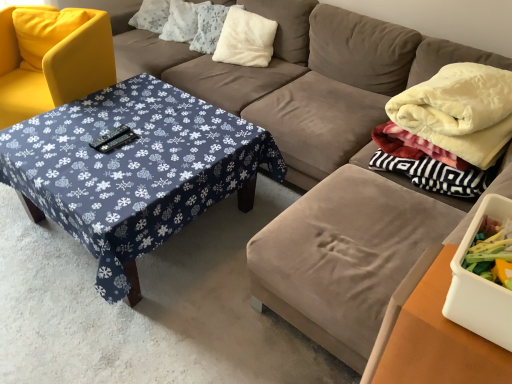
In order to face white fluffy pillow at upper center, which is the 1th pillow from left to right, should I rotate leftwards or rightwards?

To face it directly, rotate left by 9.389 degrees.

What do you see at coordinates (181, 21) in the screenshot? The height and width of the screenshot is (384, 512). I see `white fluffy pillow at upper center, the third pillow when ordered from right to left` at bounding box center [181, 21].

Describe the element at coordinates (459, 111) in the screenshot. The height and width of the screenshot is (384, 512). I see `velvet white blanket at right` at that location.

The image size is (512, 384). I want to click on white fluffy pillow at upper center, which is counted as the first pillow, starting from the right, so click(x=245, y=39).

What is the approximate height of yellow fabric chair at left?

yellow fabric chair at left is 29.38 inches tall.

The image size is (512, 384). In order to click on white fluffy pillow at center, the second pillow in the left-to-right sequence in this screenshot , I will do `click(208, 27)`.

Measure the distance between point (206, 52) and camera.

Point (206, 52) is 2.88 meters from camera.

The width and height of the screenshot is (512, 384). Find the location of `white fluffy pillow at upper center, the third pillow when ordered from right to left`. white fluffy pillow at upper center, the third pillow when ordered from right to left is located at coordinates (181, 21).

Is blue fabric-covered table at center-left oriented away from wooden table at lower right?

That's not correct — blue fabric-covered table at center-left is not looking away from wooden table at lower right.

Is blue fabric-covered table at center-left not within wooden table at lower right?

Yes, blue fabric-covered table at center-left is not within wooden table at lower right.

Looking at this image, which is more to the left, blue fabric-covered table at center-left or wooden table at lower right?

From the viewer's perspective, blue fabric-covered table at center-left appears more on the left side.

Are white fluffy pillow at upper center, the third pillow viewed from the left, and yellow fabric chair at left making contact?

No, white fluffy pillow at upper center, the third pillow viewed from the left, is not touching yellow fabric chair at left.

From the image's perspective, which one is positioned higher, white fluffy pillow at upper center, which is counted as the first pillow, starting from the right, or yellow fabric chair at left?

white fluffy pillow at upper center, which is counted as the first pillow, starting from the right, appears higher in the image.

Consider the image. Considering the relative sizes of white fluffy pillow at upper center, which is counted as the first pillow, starting from the right, and yellow fabric chair at left in the image provided, is white fluffy pillow at upper center, which is counted as the first pillow, starting from the right, wider than yellow fabric chair at left?

Incorrect, the width of white fluffy pillow at upper center, which is counted as the first pillow, starting from the right, does not surpass that of yellow fabric chair at left.

Who is shorter, white fluffy pillow at upper center, the third pillow viewed from the left, or yellow fabric chair at left?

With less height is white fluffy pillow at upper center, the third pillow viewed from the left.

Is yellow fabric chair at left located within white fluffy pillow at center, arranged as the second pillow when viewed from the right?

No, yellow fabric chair at left is not inside white fluffy pillow at center, arranged as the second pillow when viewed from the right.

Does point (213, 43) appear closer or farther from the camera than point (0, 43)?

Point (213, 43).

Who is shorter, white fluffy pillow at center, the second pillow in the left-to-right sequence, or yellow fabric chair at left?

white fluffy pillow at center, the second pillow in the left-to-right sequence, is shorter.

Consider the image. From the image's perspective, does white fluffy pillow at center, the second pillow in the left-to-right sequence, appear higher than yellow fabric chair at left?

Indeed, from the image's perspective, white fluffy pillow at center, the second pillow in the left-to-right sequence, is shown above yellow fabric chair at left.

Does blue fabric-covered table at center-left come in front of white fluffy pillow at upper center, the third pillow when ordered from right to left?

Yes, blue fabric-covered table at center-left is in front of white fluffy pillow at upper center, the third pillow when ordered from right to left.

From the picture: Is blue fabric-covered table at center-left to the left or to the right of white fluffy pillow at upper center, which is the 1th pillow from left to right, in the image?

blue fabric-covered table at center-left is to the left of white fluffy pillow at upper center, which is the 1th pillow from left to right.

Is blue fabric-covered table at center-left thinner than white fluffy pillow at upper center, the third pillow when ordered from right to left?

No, blue fabric-covered table at center-left is not thinner than white fluffy pillow at upper center, the third pillow when ordered from right to left.

Locate an element on the screen. coffee table in front of the white fluffy pillow at upper center, the third pillow when ordered from right to left is located at coordinates (133, 169).

What's the angular difference between white fluffy pillow at upper center, which is the 1th pillow from left to right, and blue fabric-covered table at center-left's facing directions?

The facing directions of white fluffy pillow at upper center, which is the 1th pillow from left to right, and blue fabric-covered table at center-left are 20.6 degrees apart.

From the image's perspective, is white fluffy pillow at upper center, which is the 1th pillow from left to right, positioned above or below blue fabric-covered table at center-left?

Clearly, from the image's perspective, white fluffy pillow at upper center, which is the 1th pillow from left to right, is above blue fabric-covered table at center-left.

Is point (166, 31) positioned before point (115, 260)?

That is False.

In terms of width, does white fluffy pillow at upper center, which is the 1th pillow from left to right, look wider or thinner when compared to blue fabric-covered table at center-left?

Clearly, white fluffy pillow at upper center, which is the 1th pillow from left to right, has less width compared to blue fabric-covered table at center-left.

Is wooden table at lower right positioned in front of white fluffy pillow at center, the second pillow in the left-to-right sequence?

That is True.

Is point (431, 268) positioned in front of point (212, 48)?

Yes, it is.

Does wooden table at lower right have a lesser width compared to white fluffy pillow at center, the second pillow in the left-to-right sequence?

Yes.

Who is smaller, wooden table at lower right or white fluffy pillow at center, the second pillow in the left-to-right sequence?

With smaller size is white fluffy pillow at center, the second pillow in the left-to-right sequence.

Would you say yellow fabric chair at left is to the left or to the right of white fluffy pillow at upper center, which is counted as the first pillow, starting from the right, in the picture?

From the image, it's evident that yellow fabric chair at left is to the left of white fluffy pillow at upper center, which is counted as the first pillow, starting from the right.

Can you see yellow fabric chair at left touching white fluffy pillow at upper center, the third pillow viewed from the left?

No, yellow fabric chair at left is not making contact with white fluffy pillow at upper center, the third pillow viewed from the left.

Image resolution: width=512 pixels, height=384 pixels. Find the location of `chair in front of the white fluffy pillow at upper center, which is counted as the first pillow, starting from the right`. chair in front of the white fluffy pillow at upper center, which is counted as the first pillow, starting from the right is located at coordinates (54, 68).

This screenshot has width=512, height=384. Identify the location of coffee table directly beneath the wooden table at lower right (from a real-world perspective). (133, 169).

I want to click on chair in front of the white fluffy pillow at upper center, the third pillow viewed from the left, so click(x=54, y=68).

When comparing their distances from velvet white blanket at right, does white fluffy pillow at upper center, which is counted as the first pillow, starting from the right, or blue fabric-covered table at center-left seem further?

Among the two, white fluffy pillow at upper center, which is counted as the first pillow, starting from the right, is located further to velvet white blanket at right.

From the picture: Considering their positions, is white fluffy pillow at upper center, which is the 1th pillow from left to right, positioned further to yellow fabric chair at left than white fluffy pillow at upper center, which is counted as the first pillow, starting from the right?

Based on the image, white fluffy pillow at upper center, which is counted as the first pillow, starting from the right, appears to be further to yellow fabric chair at left.

From the image, which object appears to be nearer to white fluffy pillow at upper center, the third pillow viewed from the left, blue fabric-covered table at center-left or wooden table at lower right?

Among the two, blue fabric-covered table at center-left is located nearer to white fluffy pillow at upper center, the third pillow viewed from the left.

From the image, which object appears to be farther from white fluffy pillow at upper center, which is the 1th pillow from left to right, wooden table at lower right or white fluffy pillow at center, the second pillow in the left-to-right sequence?

wooden table at lower right lies further to white fluffy pillow at upper center, which is the 1th pillow from left to right, than the other object.

Looking at the image, which one is located further to velvet white blanket at right, white fluffy pillow at center, the second pillow in the left-to-right sequence, or white fluffy pillow at upper center, the third pillow viewed from the left?

Based on the image, white fluffy pillow at center, the second pillow in the left-to-right sequence, appears to be further to velvet white blanket at right.

When comparing their distances from white fluffy pillow at upper center, which is the 1th pillow from left to right, does white fluffy pillow at upper center, the third pillow viewed from the left, or white fluffy pillow at center, the second pillow in the left-to-right sequence, seem closer?

white fluffy pillow at center, the second pillow in the left-to-right sequence, lies closer to white fluffy pillow at upper center, which is the 1th pillow from left to right, than the other object.

From the image, which object appears to be farther from velvet white blanket at right, white fluffy pillow at center, arranged as the second pillow when viewed from the right, or wooden table at lower right?

The object further to velvet white blanket at right is white fluffy pillow at center, arranged as the second pillow when viewed from the right.

Estimate the real-world distances between objects in this image. Which object is further from wooden table at lower right, velvet white blanket at right or blue fabric-covered table at center-left?

blue fabric-covered table at center-left.

Locate an element on the screen. pillow between velvet white blanket at right and white fluffy pillow at center, the second pillow in the left-to-right sequence, in the front-back direction is located at coordinates (245, 39).

At what (x,y) coordinates should I click in order to perform the action: click on blanket positioned between wooden table at lower right and white fluffy pillow at center, the second pillow in the left-to-right sequence, from near to far. Please return your answer as a coordinate pair (x, y). Looking at the image, I should click on (459, 111).

The height and width of the screenshot is (384, 512). I want to click on blanket between wooden table at lower right and white fluffy pillow at upper center, the third pillow when ordered from right to left, along the z-axis, so pyautogui.click(x=459, y=111).

At what (x,y) coordinates should I click in order to perform the action: click on coffee table between yellow fabric chair at left and white fluffy pillow at upper center, which is counted as the first pillow, starting from the right, from left to right. Please return your answer as a coordinate pair (x, y). The image size is (512, 384). Looking at the image, I should click on (133, 169).